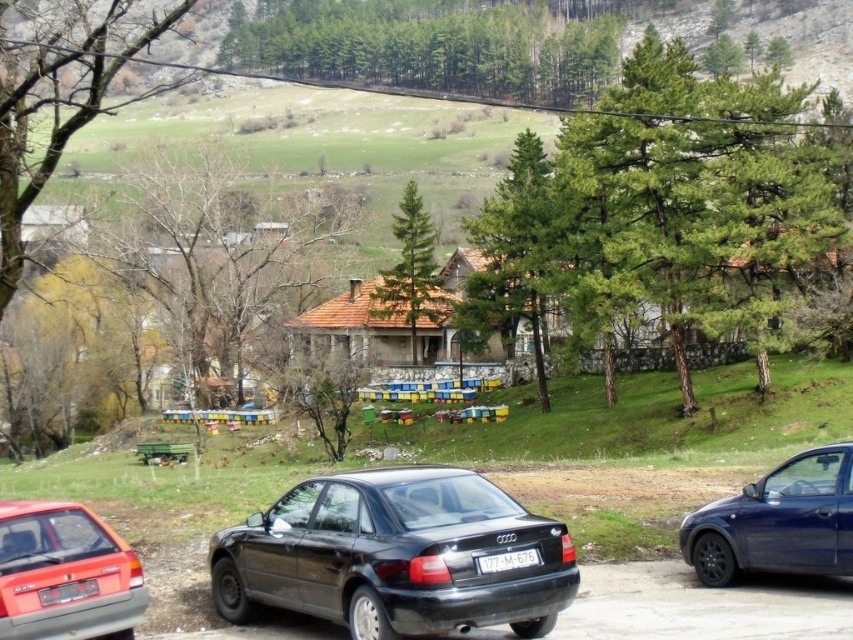
Is black glossy sedan at center below glossy blue sedan at right?

Yes, black glossy sedan at center is below glossy blue sedan at right.

Who is higher up, black glossy sedan at center or glossy blue sedan at right?

Positioned higher is glossy blue sedan at right.

Between point (466, 470) and point (735, 524), which one is positioned behind?

Point (735, 524)

Identify the location of black glossy sedan at center. (395, 556).

Between glossy blue sedan at right and white plastic license plate at center, which one appears on the right side from the viewer's perspective?

glossy blue sedan at right

Does glossy blue sedan at right appear on the right side of white plastic license plate at center?

Indeed, glossy blue sedan at right is positioned on the right side of white plastic license plate at center.

At what (x,y) coordinates should I click in order to perform the action: click on glossy blue sedan at right. Please return your answer as a coordinate pair (x, y). Looking at the image, I should click on (776, 522).

Can you confirm if matte red sedan at lower left is shorter than white plastic license plate at center?

No, matte red sedan at lower left is not shorter than white plastic license plate at center.

Can you confirm if matte red sedan at lower left is positioned above white plastic license plate at center?

Incorrect, matte red sedan at lower left is not positioned above white plastic license plate at center.

Which is in front, point (10, 525) or point (535, 557)?

Point (10, 525)

Identify the location of matte red sedan at lower left. (65, 573).